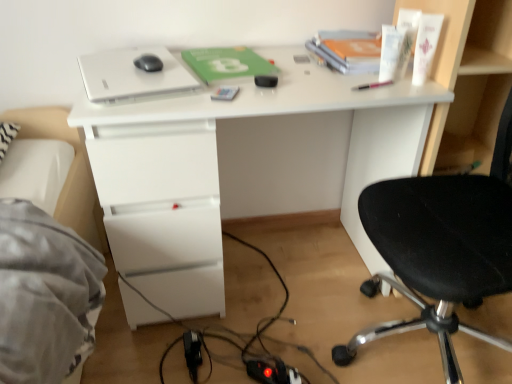
The width and height of the screenshot is (512, 384). Identify the location of vacant area situated to the left side of pink plastic pen at upper right, which is the second stationery from left to right. (309, 84).